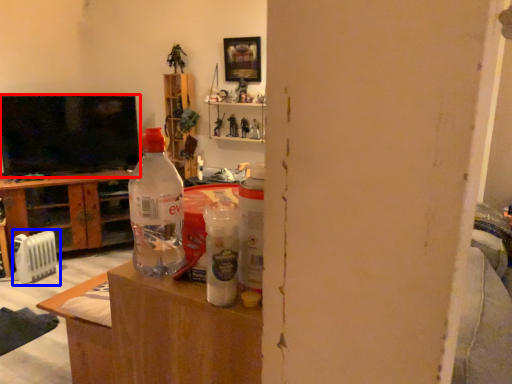
Question: Among these objects, which one is nearest to the camera, television (highlighted by a red box) or appliance (highlighted by a blue box)?

Choices:
 (A) television
 (B) appliance

Answer: (B)